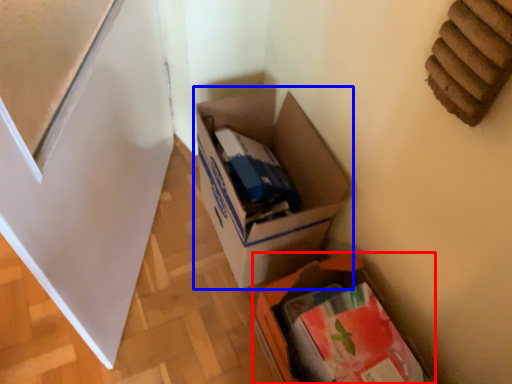
Question: Among these objects, which one is nearest to the camera, box (highlighted by a red box) or box (highlighted by a blue box)?

Choices:
 (A) box
 (B) box

Answer: (A)